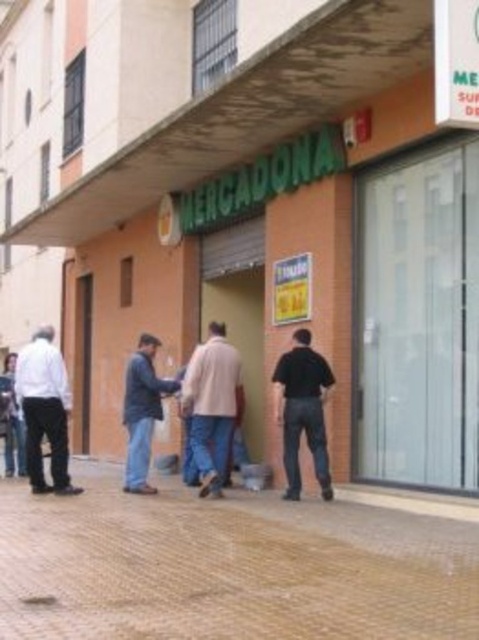
Is white shirt at left positioned behind dark blue denim jeans at center?

No, white shirt at left is in front of dark blue denim jeans at center.

Does white shirt at left have a smaller size compared to dark blue denim jeans at center?

Yes, white shirt at left is smaller than dark blue denim jeans at center.

Is point (29, 452) behind point (145, 378)?

No, (29, 452) is closer to viewer.

Locate an element on the screen. white shirt at left is located at coordinates [45, 410].

Between light beige coat at center and dark blue denim jeans at center, which one is positioned higher?

light beige coat at center is higher up.

Which is below, light beige coat at center or dark blue denim jeans at center?

dark blue denim jeans at center

At what (x,y) coordinates should I click in order to perform the action: click on light beige coat at center. Please return your answer as a coordinate pair (x, y). The width and height of the screenshot is (479, 640). Looking at the image, I should click on (213, 406).

The height and width of the screenshot is (640, 479). Identify the location of light beige coat at center. (213, 406).

Can you confirm if light beige coat at center is taller than black matte shirt at center?

Correct, light beige coat at center is much taller as black matte shirt at center.

Identify the location of light beige coat at center. (213, 406).